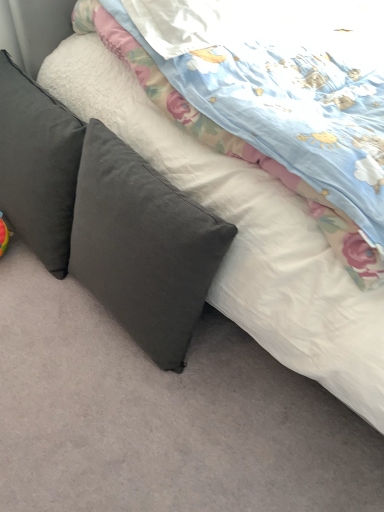
How much space does dark gray fabric pillow at left, marked as the 2th pillow in a right-to-left arrangement, occupy vertically?

19.89 inches.

The width and height of the screenshot is (384, 512). Describe the element at coordinates (38, 166) in the screenshot. I see `dark gray fabric pillow at left, marked as the 1th pillow in a left-to-right arrangement` at that location.

At what (x,y) coordinates should I click in order to perform the action: click on dark gray fabric pillow at left, marked as the 2th pillow in a right-to-left arrangement. Please return your answer as a coordinate pair (x, y). This screenshot has width=384, height=512. Looking at the image, I should click on (38, 166).

This screenshot has height=512, width=384. I want to click on dark gray fabric pillow at left, which ranks as the 1th pillow in right-to-left order, so click(x=143, y=246).

What do you see at coordinates (143, 246) in the screenshot?
I see `dark gray fabric pillow at left, the 2th pillow viewed from the left` at bounding box center [143, 246].

In order to face dark gray fabric pillow at left, the 2th pillow viewed from the left, should I rotate leftwards or rightwards?

A 8.311 degree turn to the left will do.

Measure the distance between point [213,256] and camera.

34.06 inches.

At what (x,y) coordinates should I click in order to perform the action: click on dark gray fabric pillow at left, marked as the 1th pillow in a left-to-right arrangement. Please return your answer as a coordinate pair (x, y). The image size is (384, 512). Looking at the image, I should click on (38, 166).

Considering the positions of objects dark gray fabric pillow at left, the 2th pillow viewed from the left, and dark gray fabric pillow at left, marked as the 1th pillow in a left-to-right arrangement, in the image provided, who is more to the left, dark gray fabric pillow at left, the 2th pillow viewed from the left, or dark gray fabric pillow at left, marked as the 1th pillow in a left-to-right arrangement,?

dark gray fabric pillow at left, marked as the 1th pillow in a left-to-right arrangement.

Is dark gray fabric pillow at left, the 2th pillow viewed from the left, further to the viewer compared to dark gray fabric pillow at left, marked as the 2th pillow in a right-to-left arrangement?

No, dark gray fabric pillow at left, the 2th pillow viewed from the left, is closer to the camera.

Between point (166, 219) and point (74, 193), which one is positioned behind?

Point (74, 193)

From the image's perspective, between dark gray fabric pillow at left, the 2th pillow viewed from the left, and dark gray fabric pillow at left, marked as the 1th pillow in a left-to-right arrangement, which one is located above?

dark gray fabric pillow at left, marked as the 1th pillow in a left-to-right arrangement, from the image's perspective.

From the picture: From a real-world perspective, is dark gray fabric pillow at left, the 2th pillow viewed from the left, physically located above or below dark gray fabric pillow at left, marked as the 2th pillow in a right-to-left arrangement?

From a real-world perspective, dark gray fabric pillow at left, the 2th pillow viewed from the left, is physically below dark gray fabric pillow at left, marked as the 2th pillow in a right-to-left arrangement.

Between dark gray fabric pillow at left, which ranks as the 1th pillow in right-to-left order, and dark gray fabric pillow at left, marked as the 2th pillow in a right-to-left arrangement, which one has larger width?

dark gray fabric pillow at left, marked as the 2th pillow in a right-to-left arrangement.

Which of these two, dark gray fabric pillow at left, the 2th pillow viewed from the left, or dark gray fabric pillow at left, marked as the 2th pillow in a right-to-left arrangement, stands shorter?

Standing shorter between the two is dark gray fabric pillow at left, marked as the 2th pillow in a right-to-left arrangement.

Considering the sizes of objects dark gray fabric pillow at left, the 2th pillow viewed from the left, and dark gray fabric pillow at left, marked as the 2th pillow in a right-to-left arrangement, in the image provided, who is bigger, dark gray fabric pillow at left, the 2th pillow viewed from the left, or dark gray fabric pillow at left, marked as the 2th pillow in a right-to-left arrangement,?

dark gray fabric pillow at left, marked as the 2th pillow in a right-to-left arrangement, is bigger.

Is dark gray fabric pillow at left, marked as the 1th pillow in a left-to-right arrangement, surrounded by dark gray fabric pillow at left, the 2th pillow viewed from the left?

No, dark gray fabric pillow at left, marked as the 1th pillow in a left-to-right arrangement, is not a part of dark gray fabric pillow at left, the 2th pillow viewed from the left.

Is dark gray fabric pillow at left, which ranks as the 1th pillow in right-to-left order, next to dark gray fabric pillow at left, marked as the 2th pillow in a right-to-left arrangement?

No.

Could you tell me if dark gray fabric pillow at left, which ranks as the 1th pillow in right-to-left order, is turned towards dark gray fabric pillow at left, marked as the 1th pillow in a left-to-right arrangement?

No.

How different are the orientations of dark gray fabric pillow at left, which ranks as the 1th pillow in right-to-left order, and dark gray fabric pillow at left, marked as the 2th pillow in a right-to-left arrangement, in degrees?

dark gray fabric pillow at left, which ranks as the 1th pillow in right-to-left order, and dark gray fabric pillow at left, marked as the 2th pillow in a right-to-left arrangement, are facing 0.00118 degrees away from each other.

How distant is dark gray fabric pillow at left, the 2th pillow viewed from the left, from dark gray fabric pillow at left, marked as the 1th pillow in a left-to-right arrangement?

They are 9.90 inches apart.

The image size is (384, 512). Identify the location of pillow above the dark gray fabric pillow at left, which ranks as the 1th pillow in right-to-left order (from a real-world perspective). (x=38, y=166).

Visually, is dark gray fabric pillow at left, marked as the 1th pillow in a left-to-right arrangement, positioned to the left or to the right of dark gray fabric pillow at left, which ranks as the 1th pillow in right-to-left order?

From the image, it's evident that dark gray fabric pillow at left, marked as the 1th pillow in a left-to-right arrangement, is to the left of dark gray fabric pillow at left, which ranks as the 1th pillow in right-to-left order.

Between dark gray fabric pillow at left, marked as the 1th pillow in a left-to-right arrangement, and dark gray fabric pillow at left, the 2th pillow viewed from the left, which one is positioned in front?

Positioned in front is dark gray fabric pillow at left, the 2th pillow viewed from the left.

Does point (55, 128) appear closer or farther from the camera than point (130, 211)?

Clearly, point (55, 128) is more distant from the camera than point (130, 211).

From the image's perspective, between dark gray fabric pillow at left, marked as the 2th pillow in a right-to-left arrangement, and dark gray fabric pillow at left, which ranks as the 1th pillow in right-to-left order, who is located below?

dark gray fabric pillow at left, which ranks as the 1th pillow in right-to-left order.

From a real-world perspective, relative to dark gray fabric pillow at left, the 2th pillow viewed from the left, is dark gray fabric pillow at left, marked as the 1th pillow in a left-to-right arrangement, vertically above or below?

dark gray fabric pillow at left, marked as the 1th pillow in a left-to-right arrangement, is above dark gray fabric pillow at left, the 2th pillow viewed from the left.

Between dark gray fabric pillow at left, marked as the 1th pillow in a left-to-right arrangement, and dark gray fabric pillow at left, the 2th pillow viewed from the left, which one has smaller width?

dark gray fabric pillow at left, the 2th pillow viewed from the left, is thinner.

In terms of height, does dark gray fabric pillow at left, marked as the 1th pillow in a left-to-right arrangement, look taller or shorter compared to dark gray fabric pillow at left, which ranks as the 1th pillow in right-to-left order?

Clearly, dark gray fabric pillow at left, marked as the 1th pillow in a left-to-right arrangement, is shorter compared to dark gray fabric pillow at left, which ranks as the 1th pillow in right-to-left order.

Does dark gray fabric pillow at left, marked as the 1th pillow in a left-to-right arrangement, have a smaller size compared to dark gray fabric pillow at left, which ranks as the 1th pillow in right-to-left order?

No, dark gray fabric pillow at left, marked as the 1th pillow in a left-to-right arrangement, is not smaller than dark gray fabric pillow at left, which ranks as the 1th pillow in right-to-left order.

Is dark gray fabric pillow at left, marked as the 1th pillow in a left-to-right arrangement, inside or outside of dark gray fabric pillow at left, which ranks as the 1th pillow in right-to-left order?

dark gray fabric pillow at left, marked as the 1th pillow in a left-to-right arrangement, is outside dark gray fabric pillow at left, which ranks as the 1th pillow in right-to-left order.

Is dark gray fabric pillow at left, marked as the 1th pillow in a left-to-right arrangement, directly adjacent to dark gray fabric pillow at left, which ranks as the 1th pillow in right-to-left order?

No.

Could you tell me if dark gray fabric pillow at left, marked as the 1th pillow in a left-to-right arrangement, is turned towards dark gray fabric pillow at left, the 2th pillow viewed from the left?

No, dark gray fabric pillow at left, marked as the 1th pillow in a left-to-right arrangement, does not turn towards dark gray fabric pillow at left, the 2th pillow viewed from the left.

Consider the image. Measure the distance from dark gray fabric pillow at left, marked as the 2th pillow in a right-to-left arrangement, to dark gray fabric pillow at left, the 2th pillow viewed from the left.

dark gray fabric pillow at left, marked as the 2th pillow in a right-to-left arrangement, and dark gray fabric pillow at left, the 2th pillow viewed from the left, are 9.90 inches apart.

Find the location of a particular element. pillow lying above the dark gray fabric pillow at left, the 2th pillow viewed from the left (from the image's perspective) is located at coordinates (38, 166).

What are the coordinates of `pillow to the left of dark gray fabric pillow at left, the 2th pillow viewed from the left` in the screenshot? It's located at (38, 166).

The width and height of the screenshot is (384, 512). I want to click on pillow that is above the dark gray fabric pillow at left, the 2th pillow viewed from the left (from a real-world perspective), so click(38, 166).